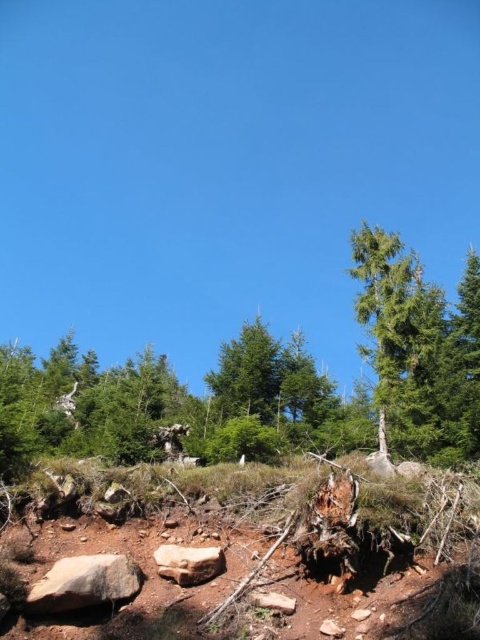
You are a hiker trying to navigate through the forest. You need to decide whether to walk around the green textured tree at center or the smooth beige rock at center. Which object requires more space to go around due to its size?

The green textured tree at center requires more space to go around because it is larger in size than the smooth beige rock at center.

You are a hiker navigating through the forest and need to step over an obstacle. You see brown dirt at center and smooth beige rock at center. Which one should you step over to avoid the rock?

You should step over the smooth beige rock at center because the brown dirt at center is positioned on the right side of it, meaning the rock is in your path.